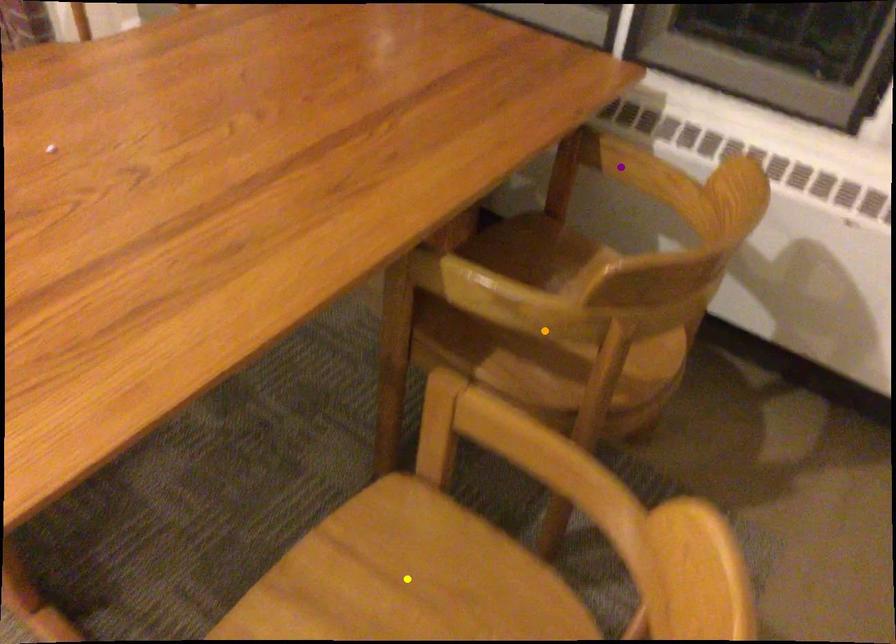
Order these from nearest to farthest:
purple point, orange point, yellow point

purple point
orange point
yellow point